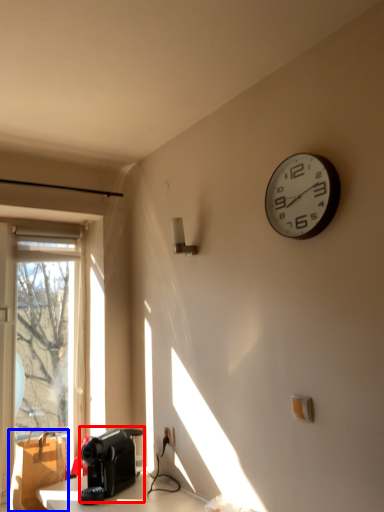
Question: Which of the following is the closest to the observer, appliance (highlighted by a red box) or cardboard box (highlighted by a blue box)?

Choices:
 (A) appliance
 (B) cardboard box

Answer: (A)